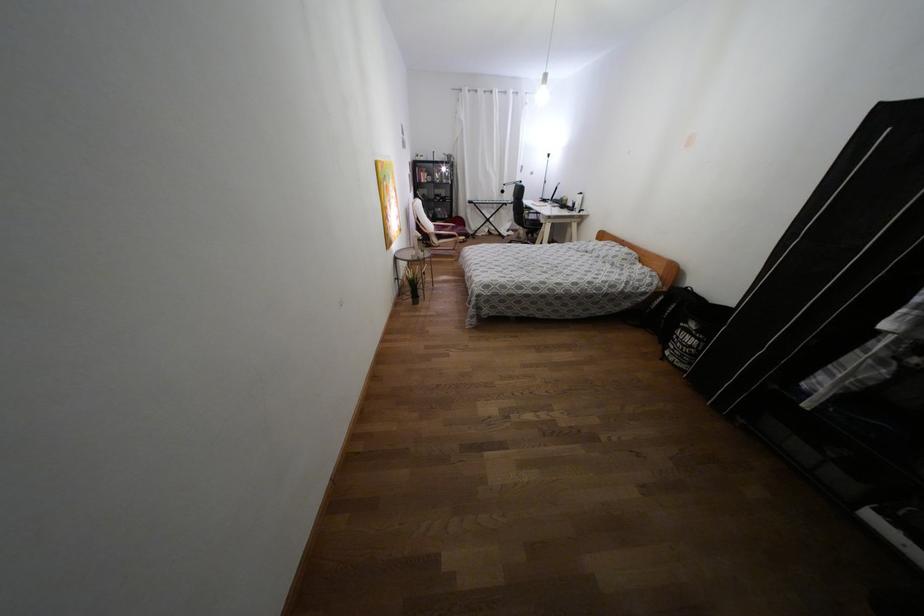
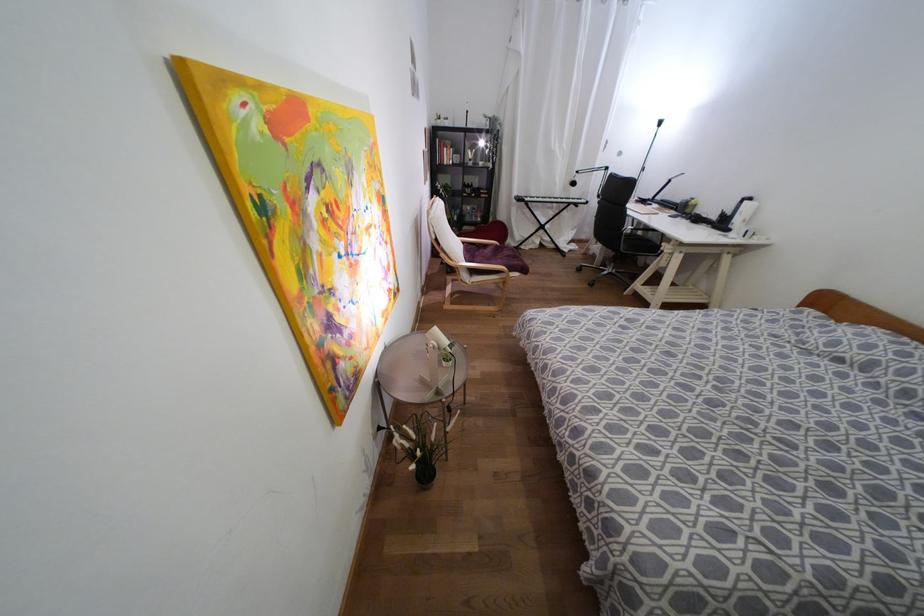
Locate, in the second image, the point that corresponds to point (419, 235) in the first image.

(444, 341)